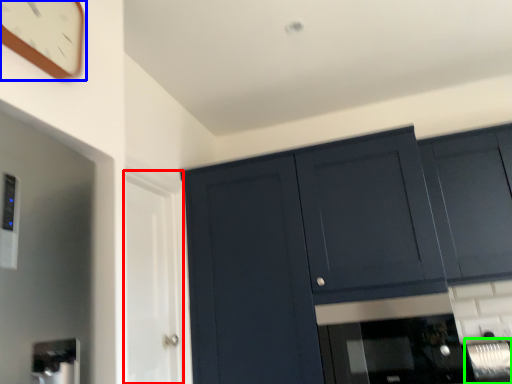
Question: Which object is positioned farthest from glass door (highlighted by a red box)? Select from clock (highlighted by a blue box) and appliance (highlighted by a green box).

Choices:
 (A) clock
 (B) appliance

Answer: (B)